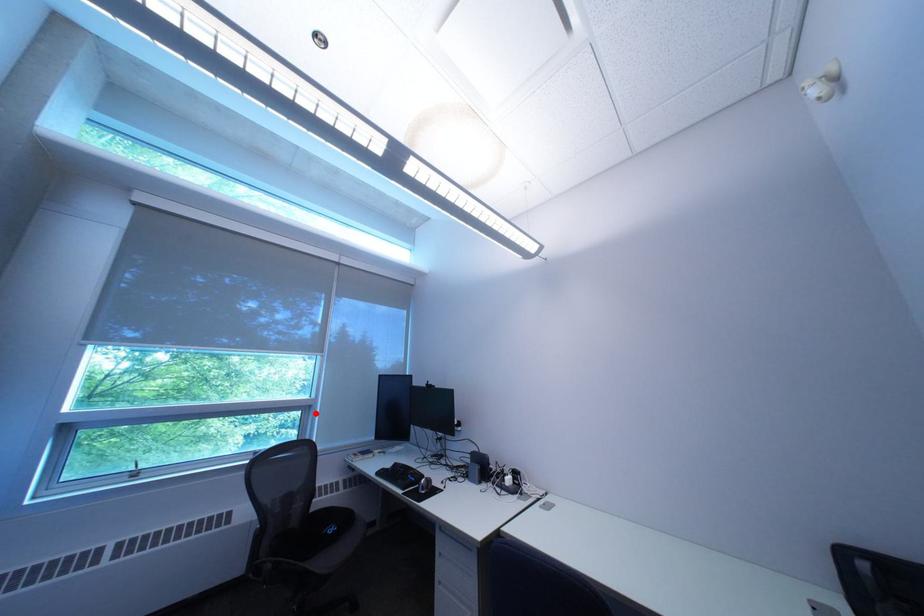
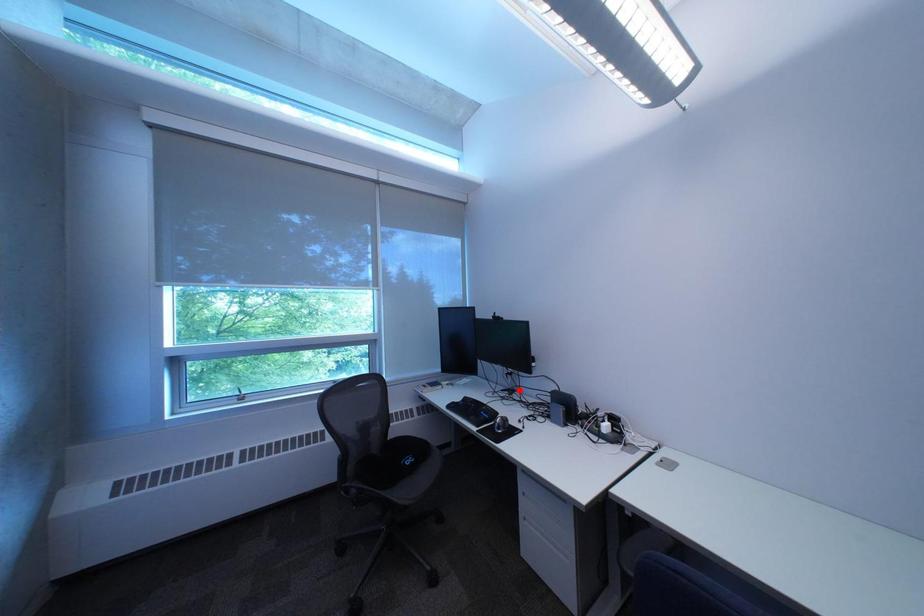
I am providing you with two images of the same scene from different viewpoints. A red point is marked on the first image and another point is marked on the second image. Is the red point in image1 aligned with the point shown in image2?

No